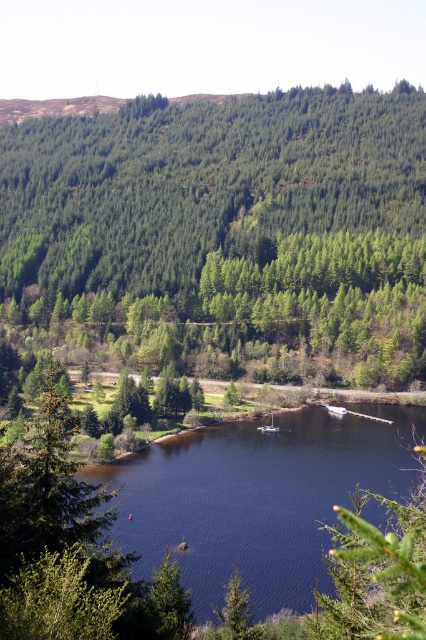
You are standing on the lakeshore and looking out towards the horizon. Which object, the green matte forest at upper center or the dark blue water at center, is located higher in the image?

The green matte forest at upper center is positioned over the dark blue water at center, so it is higher in the image.

You are standing at the edge of the lake and see two points in the image. The first point is at coordinates point (296, 532) and the second is at point (20, 476). Which point is closer to you?

Point (296, 532) is further to the camera than point (20, 476), so the point closer to you is point (20, 476).

You are planning to take a photo of the dark blue water at center and the white plastic boat at center. Which object will occupy more space in your photo?

The dark blue water at center is bigger than the white plastic boat at center, so it will occupy more space in the photo.